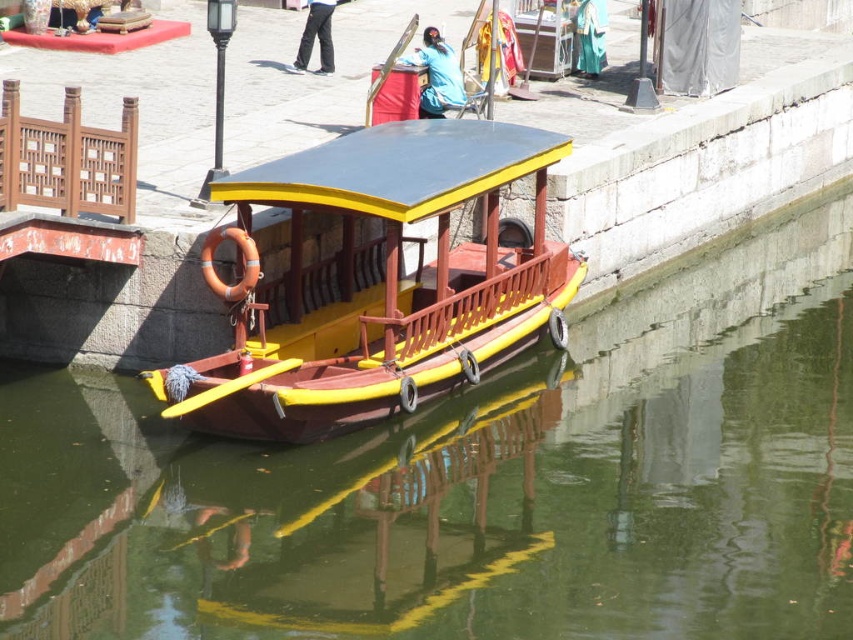
Is point (495, 477) positioned behind point (323, 68)?

No, (495, 477) is in front of (323, 68).

Can you confirm if smooth green water at center is positioned to the right of dark blue fabric pants at center?

Yes, smooth green water at center is to the right of dark blue fabric pants at center.

Where is `smooth green water at center`? Image resolution: width=853 pixels, height=640 pixels. smooth green water at center is located at coordinates (477, 486).

I want to click on smooth green water at center, so click(477, 486).

Is point (259, 573) less distant than point (578, 65)?

Yes, it is in front of point (578, 65).

Is smooth green water at center taller than teal silk robe at center?

Correct, smooth green water at center is much taller as teal silk robe at center.

Who is more forward, (758, 312) or (585, 4)?

Point (758, 312) is in front.

Locate an element on the screen. Image resolution: width=853 pixels, height=640 pixels. smooth green water at center is located at coordinates (477, 486).

Is point (459, 93) positioned before point (322, 29)?

Yes.

Does blue fabric at upper center have a greater height compared to dark blue fabric pants at center?

Indeed, blue fabric at upper center has a greater height compared to dark blue fabric pants at center.

Is point (431, 76) behind point (326, 20)?

No, (431, 76) is closer to viewer.

Locate an element on the screen. The image size is (853, 640). blue fabric at upper center is located at coordinates (437, 76).